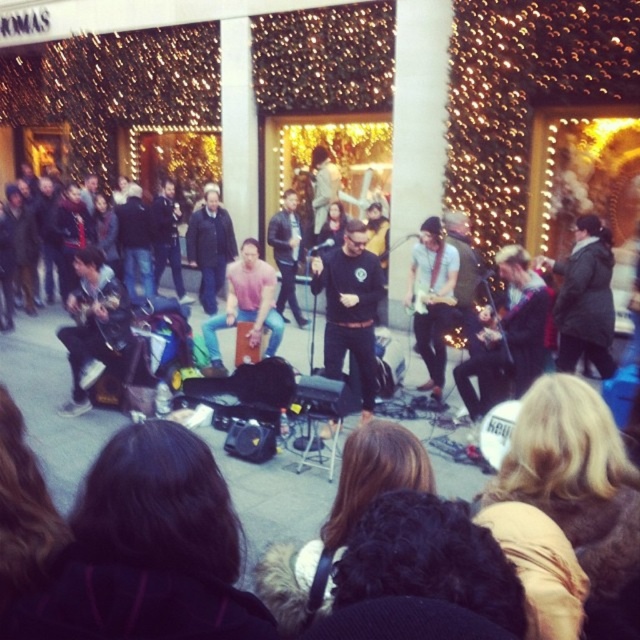
You are a performer on stage and want to hand a gift to someone in the audience. You see the black matte shirt at center and the black leather jacket at center. Can you tell which one is closer to you?

The black matte shirt at center is closer to you because it is 13.66 feet away from the black leather jacket at center, so the one with the shirt is nearer.

You are a photographer trying to capture a photo of the black matte shirt at center and the pink cotton shirt at center in the crowd. Which one is positioned lower in the image?

The black matte shirt at center is located below the pink cotton shirt at center, so it is positioned lower in the image.